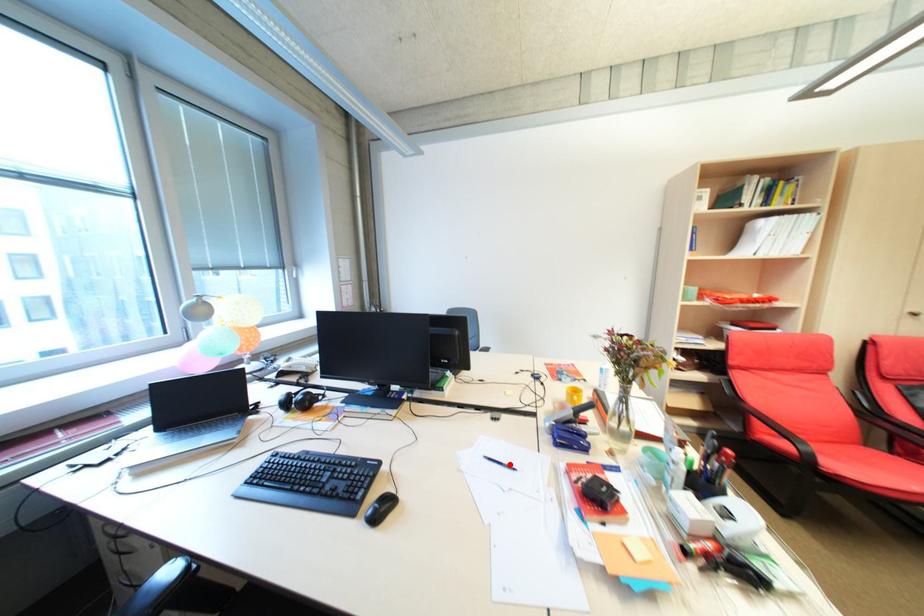
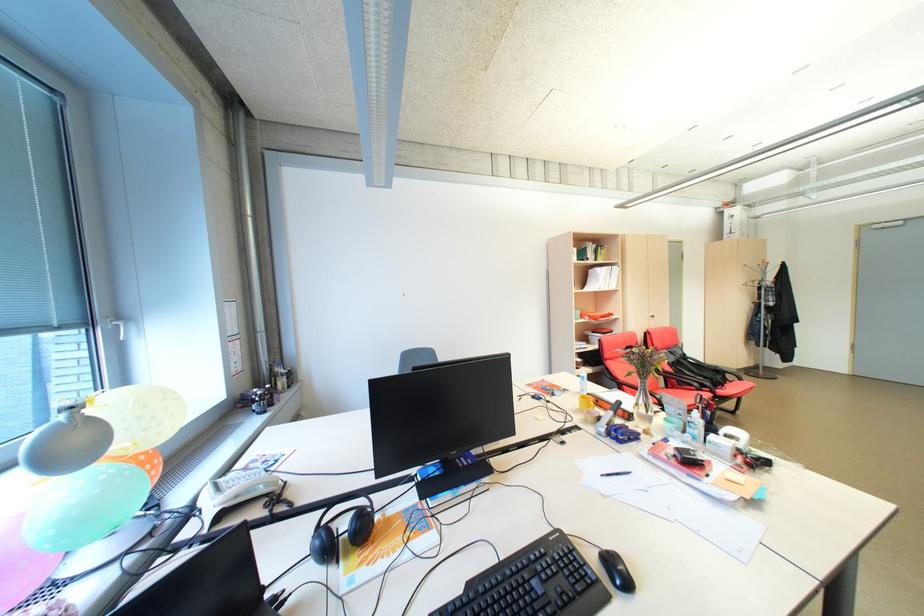
Where in the second image is the point corresponding to the highlighted location from the first image?

(627, 475)